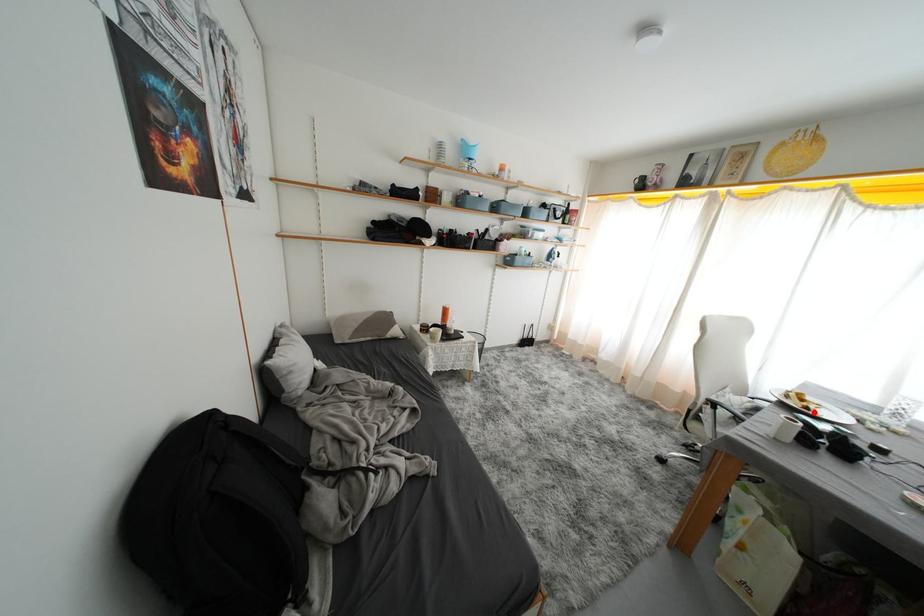
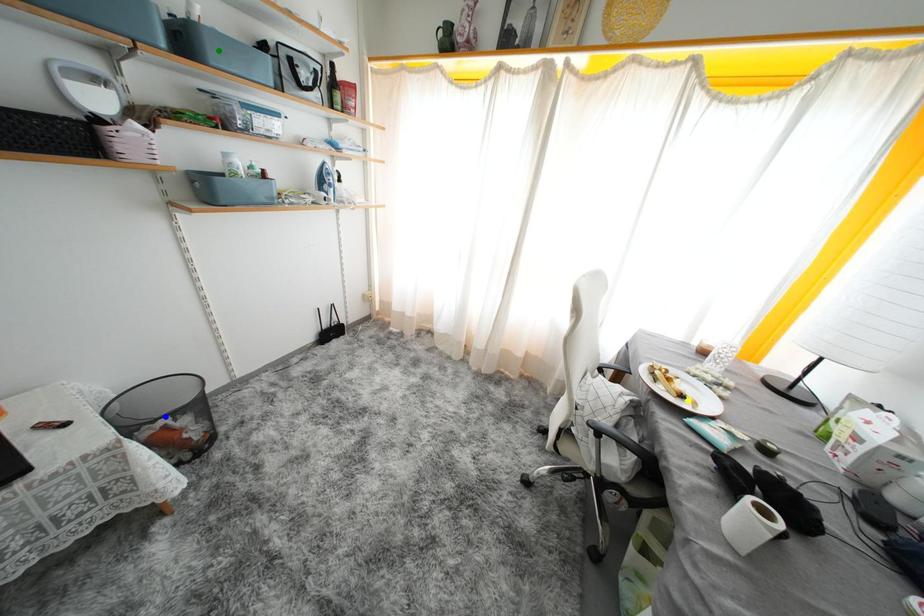
Question: I am providing you with two images of the same scene from different viewpoints. A red point is marked on the first image. You are given multiple points on the second image. Which point in image 2 represents the same 3d spot as the red point in image 1?

Choices:
 (A) green point
 (B) yellow point
 (C) blue point

Answer: (B)